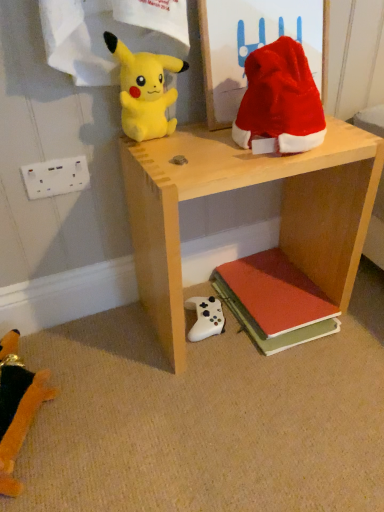
This screenshot has height=512, width=384. Find the location of `vacant area that lies in front of red matte book at lower right`. vacant area that lies in front of red matte book at lower right is located at coordinates (291, 381).